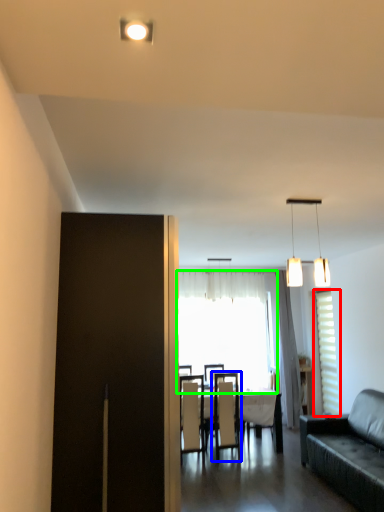
Question: Which object is the closest to the window (highlighted by a red box)? Choose among these: chair (highlighted by a blue box) or window (highlighted by a green box).

Choices:
 (A) chair
 (B) window

Answer: (A)